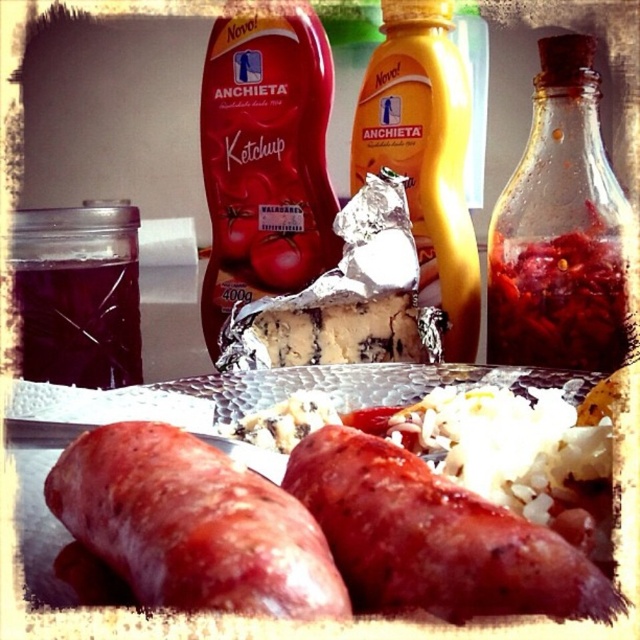
Who is more forward, (344, 595) or (493, 225)?

Point (344, 595) is in front.

Is red glossy sausage at lower left below translucent glass jar at upper right?

Correct, red glossy sausage at lower left is located below translucent glass jar at upper right.

Find the location of `red glossy sausage at lower left`. red glossy sausage at lower left is located at coordinates (193, 524).

Can you confirm if translucent glass jar at upper right is taller than yellow matte bottle at center?

In fact, translucent glass jar at upper right may be shorter than yellow matte bottle at center.

Is translucent glass jar at upper right positioned in front of yellow matte bottle at center?

Yes, translucent glass jar at upper right is in front of yellow matte bottle at center.

This screenshot has width=640, height=640. Find the location of `translucent glass jar at upper right`. translucent glass jar at upper right is located at coordinates (560, 228).

In the scene shown: Which of these two, red glossy sausage at lower left or red glossy sausage at center, stands shorter?

red glossy sausage at lower left

Locate an element on the screen. The width and height of the screenshot is (640, 640). red glossy sausage at lower left is located at coordinates (193, 524).

The height and width of the screenshot is (640, 640). In order to click on red glossy sausage at lower left in this screenshot , I will do `click(193, 524)`.